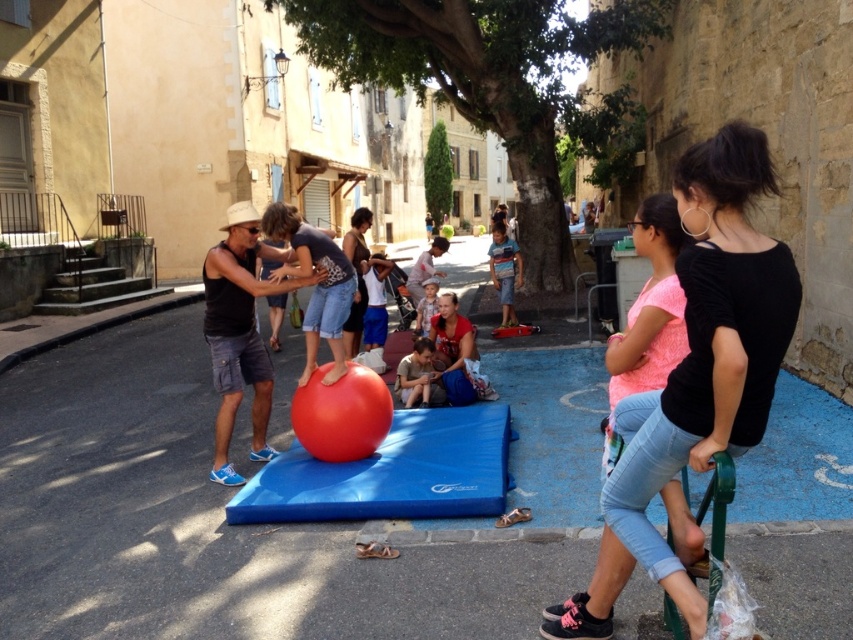
Question: Is the position of black matte shirt at upper right less distant than that of light brown wooden chair at center?

Choices:
 (A) no
 (B) yes

Answer: (B)

Question: Which object is farther from the camera taking this photo?

Choices:
 (A) smooth skin child at center
 (B) rubber ball at center
 (C) light brown wooden chair at center

Answer: (C)

Question: Which point is farther from the camera taking this photo?

Choices:
 (A) (225, 349)
 (B) (572, 612)
 (C) (500, 234)

Answer: (C)

Question: Does rubber ball at center have a smaller size compared to striped shirt at center?

Choices:
 (A) yes
 (B) no

Answer: (B)

Question: From the image, what is the correct spatial relationship of striped shirt at center in relation to light brown wooden chair at center?

Choices:
 (A) left
 (B) right

Answer: (B)

Question: Which of the following is the closest to the observer?

Choices:
 (A) (688, 184)
 (B) (235, 305)
 (C) (503, 320)

Answer: (A)